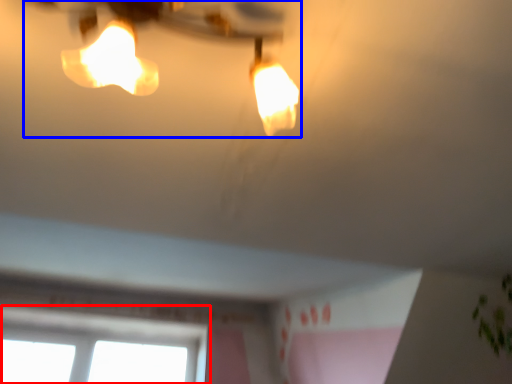
Question: Which of the following is the closest to the observer, window (highlighted by a red box) or lamp (highlighted by a blue box)?

Choices:
 (A) window
 (B) lamp

Answer: (B)